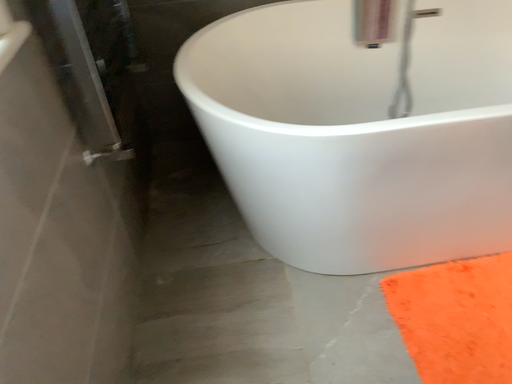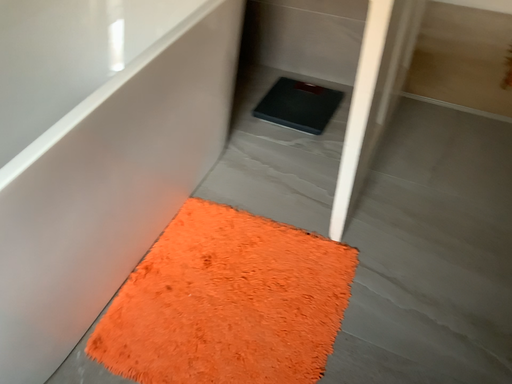
Question: How did the camera likely rotate when shooting the video?

Choices:
 (A) rotated downward
 (B) rotated upward

Answer: (B)